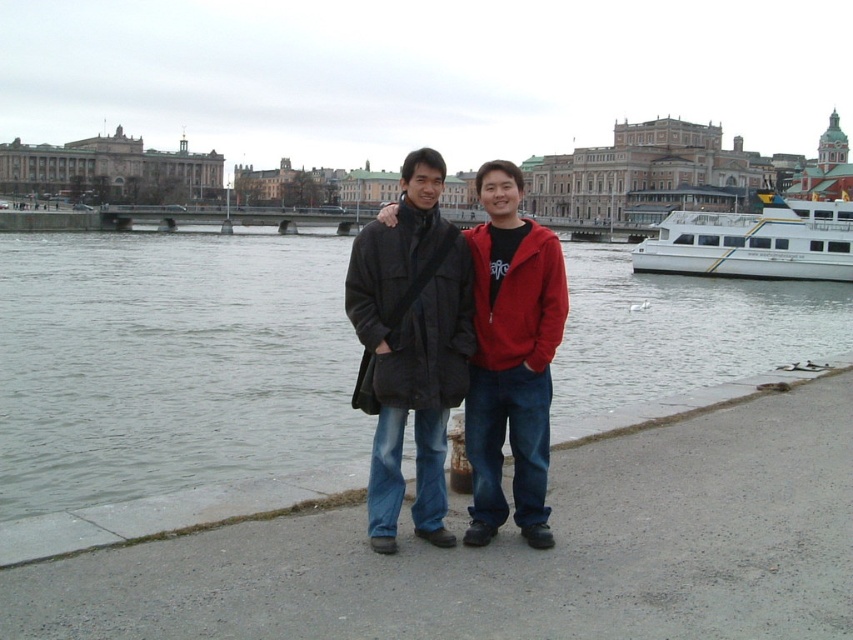
You are planning to cross the river using a small boat that is 10 feet wide. You see the gray water at lower left and the white glossy boat at right. Is there enough space between them to safely launch your boat?

The gray water at lower left and white glossy boat at right are 66.82 feet apart from each other. Since your boat is only 10 feet wide, there is sufficient space to safely launch it between them.

You are standing at the point with coordinates point [688,221] and want to walk to the point with coordinates point [291,336]. Which direction should you move relative to your current position?

You should move forward because point [291,336] is in front of point [688,221].